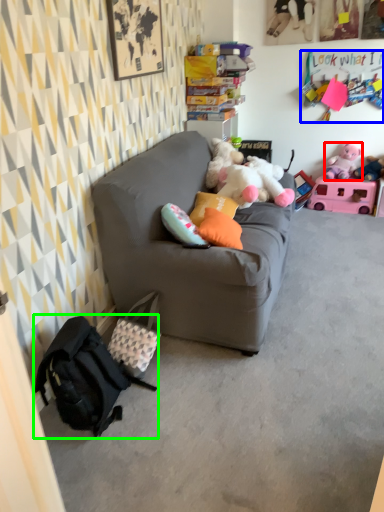
Question: Which object is positioned closest to toy (highlighted by a red box)? Select from toy (highlighted by a blue box) and backpack (highlighted by a green box).

Choices:
 (A) toy
 (B) backpack

Answer: (A)